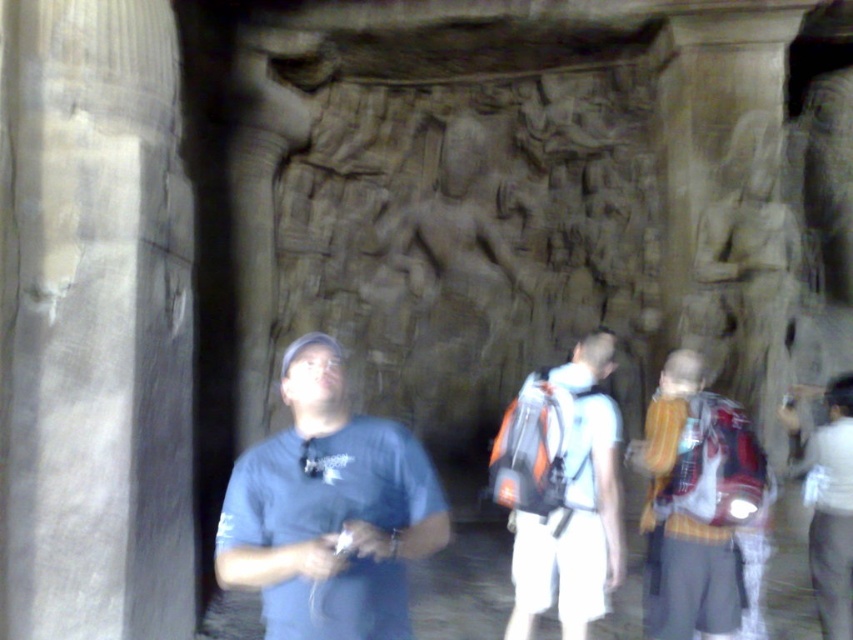
Between white matte backpack at center and white cotton shirt at center, which one has less height?

With less height is white cotton shirt at center.

Between point (529, 576) and point (821, 490), which one is positioned behind?

Point (821, 490)

This screenshot has width=853, height=640. Describe the element at coordinates (561, 490) in the screenshot. I see `white matte backpack at center` at that location.

Find the location of `white matte backpack at center`. white matte backpack at center is located at coordinates (561, 490).

Between white marble pillar at left and white matte backpack at center, which one appears on the right side from the viewer's perspective?

Positioned to the right is white matte backpack at center.

Between white marble pillar at left and white matte backpack at center, which one appears on the left side from the viewer's perspective?

From the viewer's perspective, white marble pillar at left appears more on the left side.

Measure the distance between white marble pillar at left and camera.

They are 3.77 meters apart.

This screenshot has width=853, height=640. Identify the location of white marble pillar at left. (93, 324).

How far apart are blue fabric shirt at center and yellow striped shirt at center?

They are 5.83 feet apart.

Looking at this image, is blue fabric shirt at center behind yellow striped shirt at center?

That is False.

Measure the distance between point (276, 604) and camera.

A distance of 8.86 feet exists between point (276, 604) and camera.

Where is `blue fabric shirt at center`? blue fabric shirt at center is located at coordinates (328, 509).